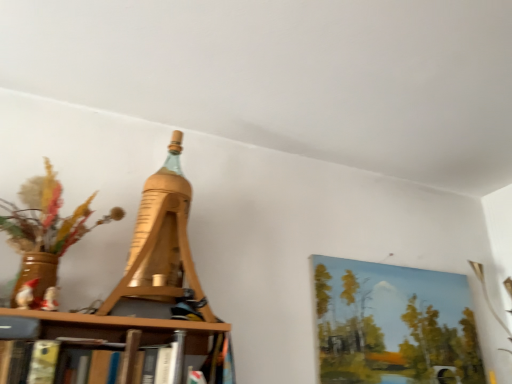
Question: Does wooden eiffel tower at center have a smaller size compared to painted canvas at upper right?

Choices:
 (A) no
 (B) yes

Answer: (A)

Question: Is wooden eiffel tower at center positioned beyond the bounds of painted canvas at upper right?

Choices:
 (A) no
 (B) yes

Answer: (B)

Question: Is the depth of wooden eiffel tower at center less than that of painted canvas at upper right?

Choices:
 (A) no
 (B) yes

Answer: (B)

Question: Can you confirm if wooden eiffel tower at center is shorter than painted canvas at upper right?

Choices:
 (A) yes
 (B) no

Answer: (B)

Question: From a real-world perspective, is wooden eiffel tower at center physically below painted canvas at upper right?

Choices:
 (A) no
 (B) yes

Answer: (A)

Question: Is painted canvas at upper right located within wooden eiffel tower at center?

Choices:
 (A) yes
 (B) no

Answer: (B)

Question: Is painted canvas at upper right outside wooden eiffel tower at center?

Choices:
 (A) no
 (B) yes

Answer: (B)

Question: From the image's perspective, is painted canvas at upper right on top of wooden eiffel tower at center?

Choices:
 (A) yes
 (B) no

Answer: (B)

Question: Considering the relative sizes of painted canvas at upper right and wooden eiffel tower at center in the image provided, is painted canvas at upper right smaller than wooden eiffel tower at center?

Choices:
 (A) yes
 (B) no

Answer: (A)

Question: From a real-world perspective, is painted canvas at upper right positioned under wooden eiffel tower at center based on gravity?

Choices:
 (A) no
 (B) yes

Answer: (B)

Question: Does painted canvas at upper right touch wooden eiffel tower at center?

Choices:
 (A) yes
 (B) no

Answer: (B)

Question: Considering the relative sizes of painted canvas at upper right and wooden eiffel tower at center in the image provided, is painted canvas at upper right wider than wooden eiffel tower at center?

Choices:
 (A) no
 (B) yes

Answer: (A)

Question: Is point (177, 258) closer or farther from the camera than point (346, 370)?

Choices:
 (A) closer
 (B) farther

Answer: (A)